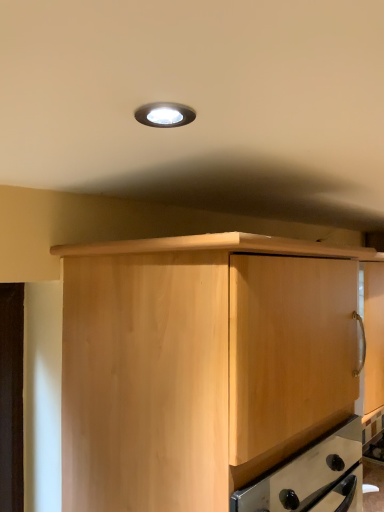
Describe the element at coordinates (218, 373) in the screenshot. This screenshot has width=384, height=512. I see `light wood cabinet at center` at that location.

Measure the distance between point (312, 268) and camera.

Point (312, 268) and camera are 1.01 meters apart.

Identify the location of light wood cabinet at center. This screenshot has height=512, width=384. (218, 373).

Measure the distance between light wood cabinet at center and camera.

31.19 inches.

Locate an element on the screen. light wood cabinet at center is located at coordinates (218, 373).